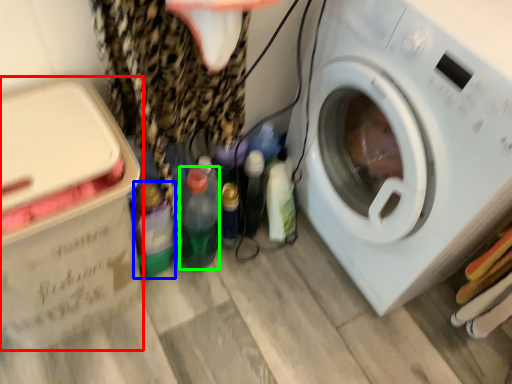
Question: Estimate the real-world distances between objects in this image. Which object is farther from cardboard box (highlighted by a red box), bottle (highlighted by a blue box) or bottle (highlighted by a green box)?

Choices:
 (A) bottle
 (B) bottle

Answer: (B)